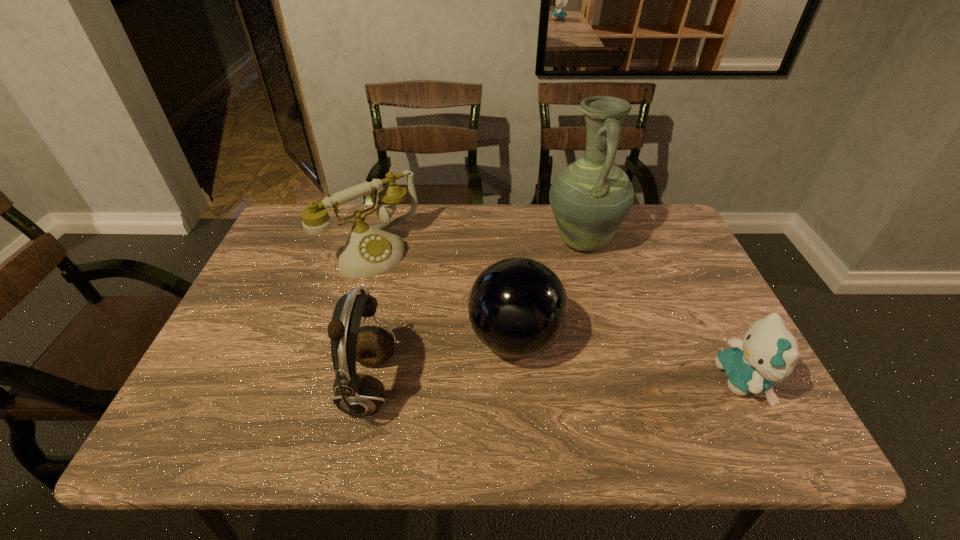
Find the location of a particular element. pitcher situated at the far edge is located at coordinates (590, 198).

Locate an element on the screen. This screenshot has height=540, width=960. earphone present at the near edge is located at coordinates (360, 395).

Where is `kitten that is at the near edge`? The height and width of the screenshot is (540, 960). kitten that is at the near edge is located at coordinates (768, 353).

The height and width of the screenshot is (540, 960). Find the location of `bowling ball located at the near edge`. bowling ball located at the near edge is located at coordinates (518, 307).

Find the location of a particular element. object at the left edge is located at coordinates (369, 251).

Image resolution: width=960 pixels, height=540 pixels. Identify the location of object present at the right edge. click(768, 353).

This screenshot has width=960, height=540. In order to click on object that is at the far left corner in this screenshot , I will do 369,251.

The image size is (960, 540). Find the location of `object at the near right corner`. object at the near right corner is located at coordinates (768, 353).

Where is `free space at the far edge of the desktop`? free space at the far edge of the desktop is located at coordinates (488, 234).

Where is `free point at the near edge`? The width and height of the screenshot is (960, 540). free point at the near edge is located at coordinates (411, 383).